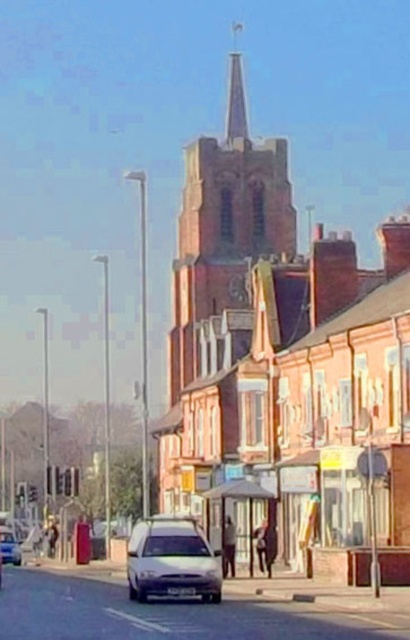
Question: Considering the relative positions of brick church steeple at center and white matte car at lower left in the image provided, where is brick church steeple at center located with respect to white matte car at lower left?

Choices:
 (A) above
 (B) below

Answer: (A)

Question: Among these points, which one is farthest from the camera?

Choices:
 (A) (0, 572)
 (B) (143, 522)
 (C) (4, 529)

Answer: (C)

Question: Which object is positioned closest to the brick church steeple at center?

Choices:
 (A) silver metallic van at center
 (B) white matte car at center
 (C) white matte car at lower left

Answer: (A)

Question: Is silver metallic van at center wider than white matte car at center?

Choices:
 (A) no
 (B) yes

Answer: (B)

Question: Which of the following is the farthest from the observer?

Choices:
 (A) silver metallic van at center
 (B) white matte car at lower left
 (C) brick church steeple at center
 (D) white matte car at center

Answer: (B)

Question: Is silver metallic van at center wider than white matte car at center?

Choices:
 (A) yes
 (B) no

Answer: (A)